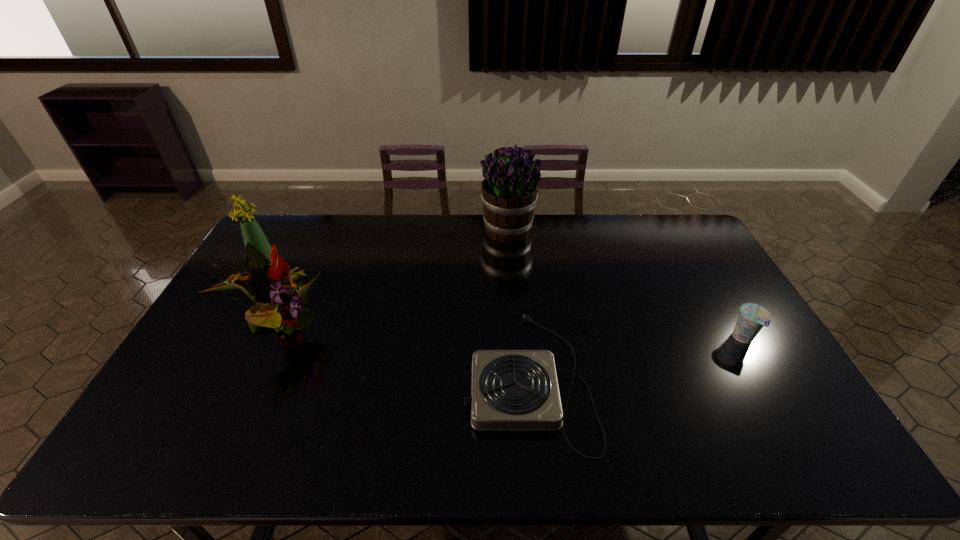
Identify the location of the farthest object. (509, 193).

Locate an element on the screen. This screenshot has width=960, height=540. the farthest bouquet is located at coordinates (509, 193).

The width and height of the screenshot is (960, 540). I want to click on the second farthest object, so click(x=251, y=231).

You are a GUI agent. You are given a task and a screenshot of the screen. Output one action in this format:
    pyautogui.click(x=<x>, y=<y>)
    Task: Click on the leftmost bouquet
    This screenshot has width=960, height=540.
    Given the screenshot: What is the action you would take?
    pyautogui.click(x=251, y=231)

The image size is (960, 540). I want to click on the nearest bouquet, so click(x=275, y=311).

The height and width of the screenshot is (540, 960). Identify the location of the second object from left to right. (275, 311).

Where is `yogurt`? This screenshot has height=540, width=960. yogurt is located at coordinates (752, 317).

Locate an element on the screen. The image size is (960, 540). the second shortest object is located at coordinates (752, 317).

At what (x,y) coordinates should I click in order to perform the action: click on hotplate. Please return your answer as a coordinate pair (x, y). Image resolution: width=960 pixels, height=540 pixels. Looking at the image, I should click on (511, 390).

The width and height of the screenshot is (960, 540). Find the location of `free point located on the front of the farthest object`. free point located on the front of the farthest object is located at coordinates (x=514, y=289).